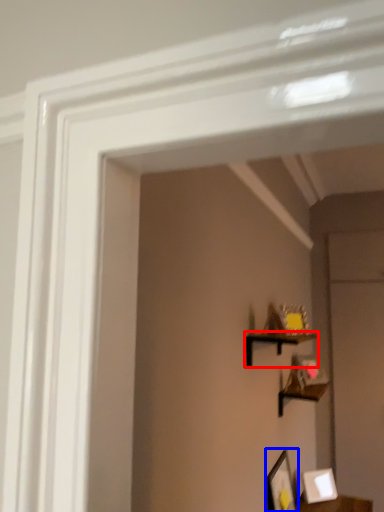
Question: Which object is further to the camera taking this photo, shelf (highlighted by a red box) or picture frame (highlighted by a blue box)?

Choices:
 (A) shelf
 (B) picture frame

Answer: (B)